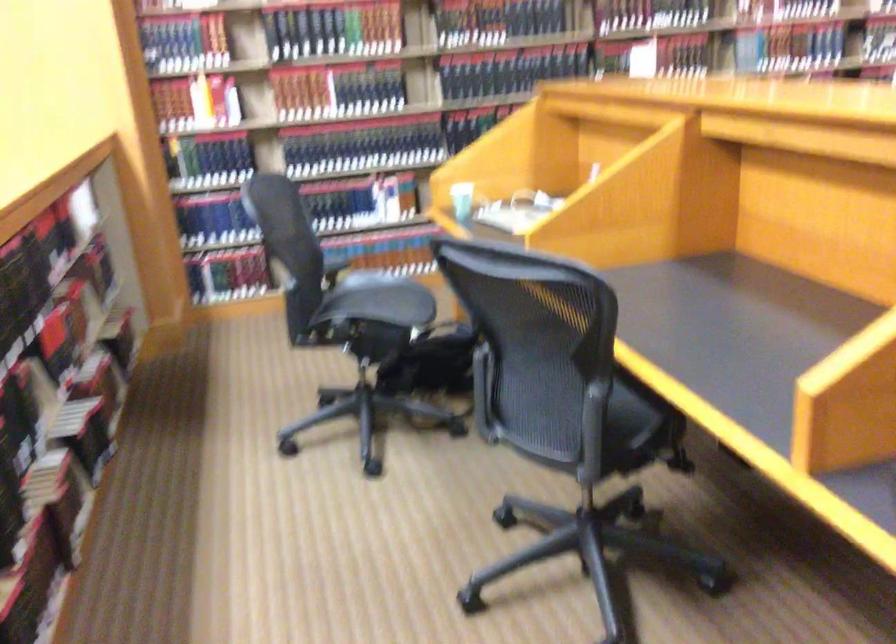
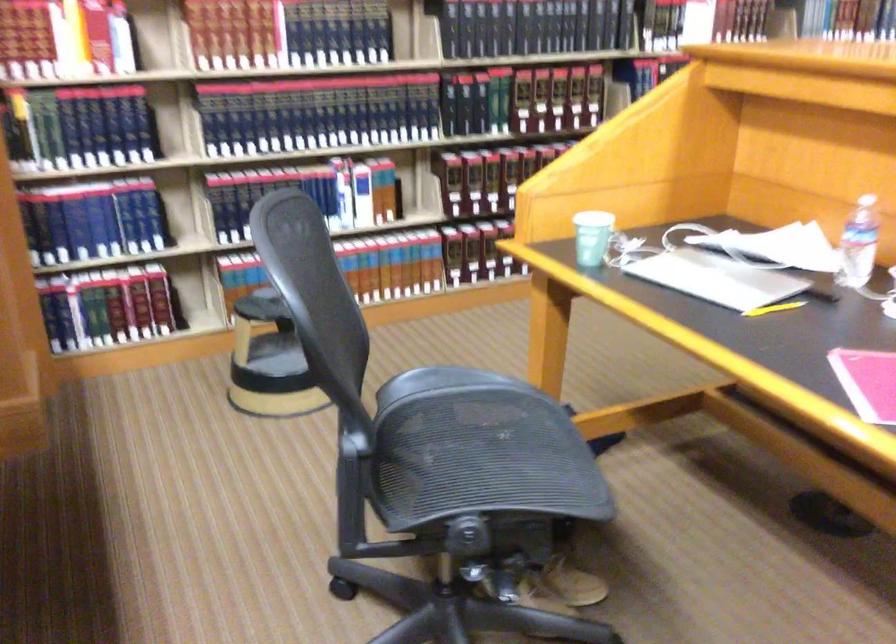
Locate, in the second image, the point that corresponds to the point at 462,200 in the first image.

(591, 237)